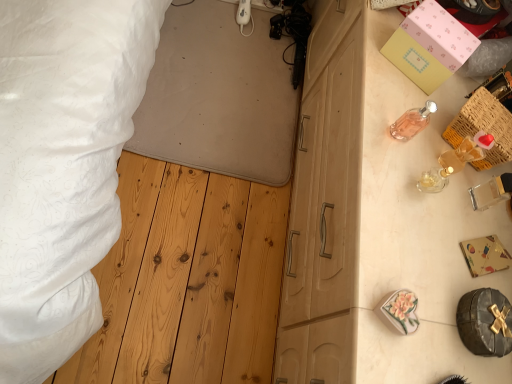
I want to click on free spot in front of pink glass perfume at upper right, so click(384, 182).